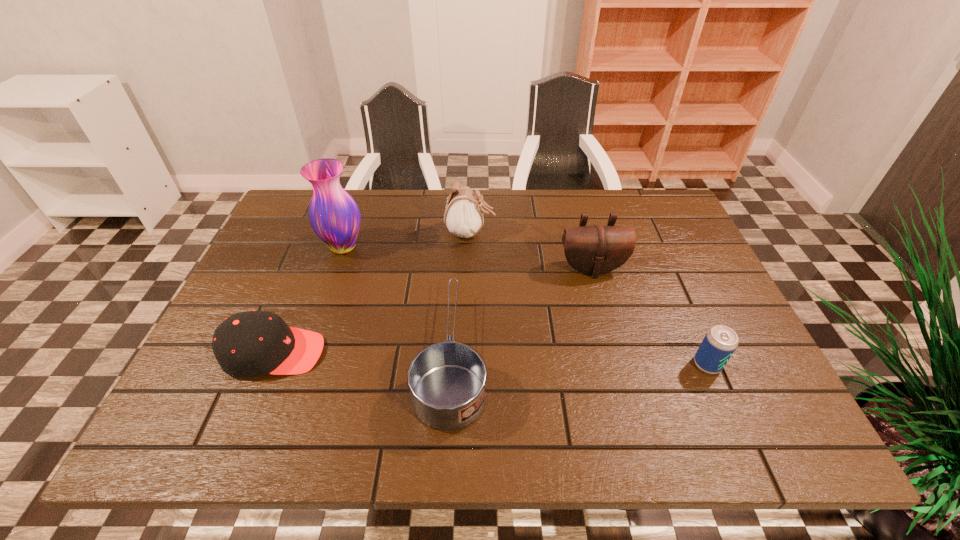
Where is `the tallest object`? This screenshot has width=960, height=540. the tallest object is located at coordinates (334, 216).

Identify the location of the farther pouch. The image size is (960, 540). (463, 217).

Locate an element on the screen. the fifth object from left to right is located at coordinates (594, 250).

Locate an element on the screen. the nearer pouch is located at coordinates (594, 250).

Find the location of `cap`. cap is located at coordinates (252, 343).

You are a GUI agent. You are given a task and a screenshot of the screen. Output one action in this format:
    pyautogui.click(x=<x>, y=<y>)
    Task: Click on the beer can
    
    Given the screenshot: What is the action you would take?
    pyautogui.click(x=720, y=342)

Where is `saucepan`? saucepan is located at coordinates (447, 381).

This screenshot has height=540, width=960. I want to click on vacant point located on the right of the tallest object, so click(464, 247).

Find the location of a particular element. The image size is (960, 540). vacant region located on the front-facing side of the left pouch is located at coordinates (558, 233).

You are a GUI agent. You are given a task and a screenshot of the screen. Output one action in this format:
    pyautogui.click(x=<x>, y=<y>)
    Task: Click on the free spot located with the flap open on the right pouch
    
    Given the screenshot: What is the action you would take?
    pyautogui.click(x=621, y=377)